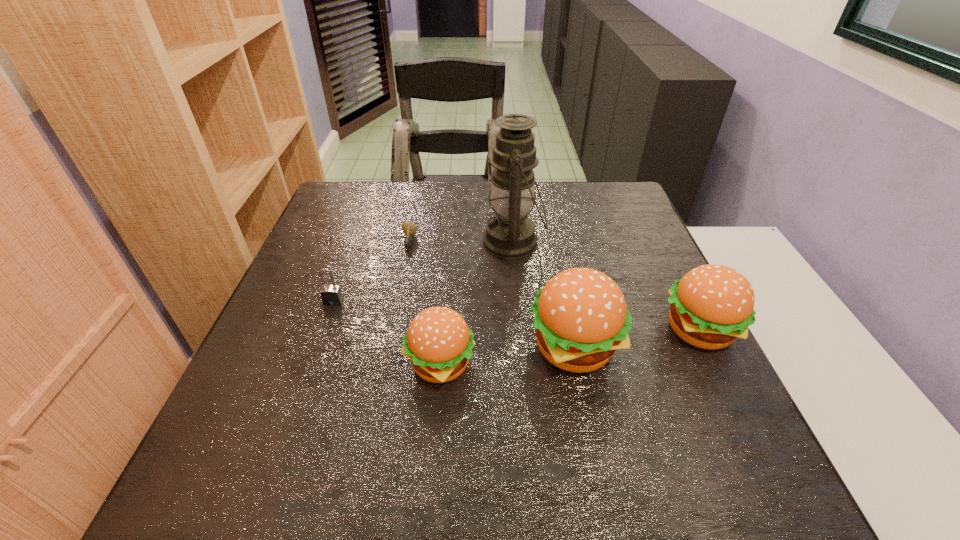
Image resolution: width=960 pixels, height=540 pixels. I want to click on the leftmost hamburger, so click(439, 343).

I want to click on the fourth tallest object, so click(x=439, y=343).

The image size is (960, 540). What are the coordinates of `the second hamburger from left to right` in the screenshot? It's located at (580, 316).

Image resolution: width=960 pixels, height=540 pixels. What are the coordinates of `the rightmost hamburger` in the screenshot? It's located at (712, 305).

Find the location of a particular element. The width and height of the screenshot is (960, 540). the fourth shortest object is located at coordinates (712, 305).

Locate an element on the screen. oil lamp is located at coordinates (509, 234).

Locate an element on the screen. the shortest object is located at coordinates (409, 229).

At what (x,y) coordinates should I click in order to perform the action: click on escargot. Please return your answer as a coordinate pair (x, y). Looking at the image, I should click on (409, 229).

Identify the location of the fifth tallest object. (331, 295).

Where is `padlock`? padlock is located at coordinates (331, 295).